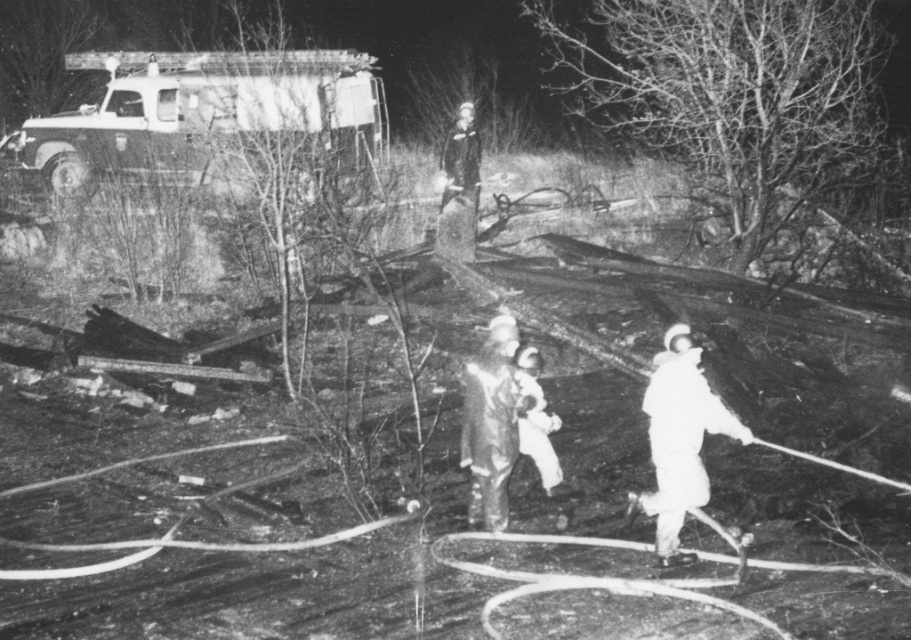
You are a firefighter in the scene. You need to reach the bare branches at upper right to check for any hazards. What is the shortest path you can take from your current position at point (732, 97)?

The shortest path to the bare branches at upper right would be to move directly towards them since they are located at point (732, 97), which is your current position.

You are an emergency responder needing to relay a message to your team member wearing the white matte uniform at center. You are currently wearing the dark gray uniform at center. Given that your voice can carry up to 10 meters, can you communicate with them without using a radio?

The distance between the dark gray uniform at center and the white matte uniform at center is 7.46 meters, which is within the 10 meter range your voice can carry. Therefore, you can communicate with them without a radio.

You are a drone operator assigned to monitor the emergency site. Your drone has a maximum operational range of 15 meters. If you want to capture a closeup of the dark gray uniform at center, will your drone be able to reach it?

The dark gray uniform at center is 14.77 meters away from the viewer, which is within the drone operator s 15 meters operational range. Therefore, the drone can reach the dark gray uniform at center to capture a closeup.